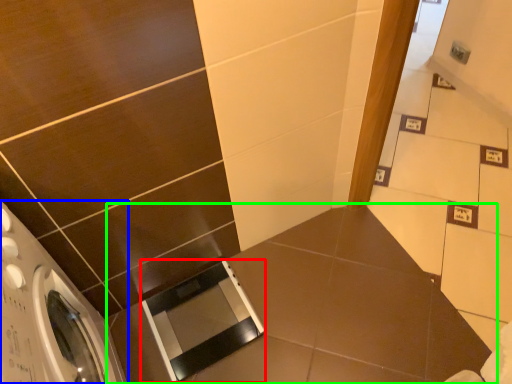
Question: Based on their relative distances, which object is nearer to screen door (highlighted by a red box)? Choose from washing machine (highlighted by a blue box) and counter top (highlighted by a green box).

Choices:
 (A) washing machine
 (B) counter top

Answer: (B)